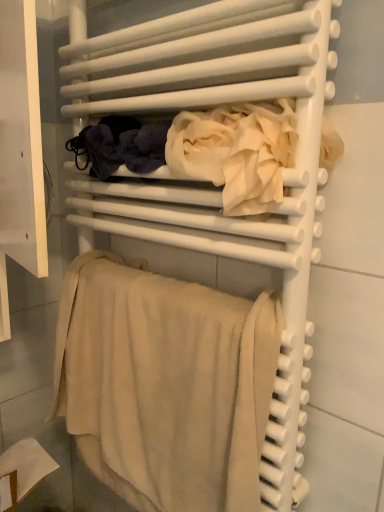
Image resolution: width=384 pixels, height=512 pixels. Describe the element at coordinates (165, 384) in the screenshot. I see `beige textured towel at lower center` at that location.

This screenshot has width=384, height=512. I want to click on beige textured towel at lower center, so click(x=165, y=384).

Describe the element at coordinates (204, 150) in the screenshot. I see `white cotton towel at center` at that location.

This screenshot has width=384, height=512. I want to click on white cotton towel at center, so click(x=204, y=150).

Image resolution: width=384 pixels, height=512 pixels. In order to click on beige textured towel at lower center in this screenshot , I will do `click(165, 384)`.

Considering the positions of objects white cotton towel at center and beige textured towel at lower center in the image provided, who is more to the left, white cotton towel at center or beige textured towel at lower center?

From the viewer's perspective, beige textured towel at lower center appears more on the left side.

Is the position of white cotton towel at center less distant than that of beige textured towel at lower center?

Yes, it is.

Does point (182, 136) come farther from viewer compared to point (229, 472)?

No, it is not.

From the image's perspective, is white cotton towel at center located above or below beige textured towel at lower center?

Based on their image positions, white cotton towel at center is located above beige textured towel at lower center.

From a real-world perspective, is white cotton towel at center positioned over beige textured towel at lower center based on gravity?

Yes, from a real-world perspective, white cotton towel at center is on top of beige textured towel at lower center.

Between white cotton towel at center and beige textured towel at lower center, which one has larger width?

With larger width is white cotton towel at center.

Is white cotton towel at center taller or shorter than beige textured towel at lower center?

white cotton towel at center is shorter than beige textured towel at lower center.

Based on their sizes in the image, would you say white cotton towel at center is bigger or smaller than beige textured towel at lower center?

Considering their sizes, white cotton towel at center takes up less space than beige textured towel at lower center.

Is white cotton towel at center completely or partially outside of beige textured towel at lower center?

Absolutely, white cotton towel at center is external to beige textured towel at lower center.

Can you see white cotton towel at center touching beige textured towel at lower center?

They are not placed beside each other.

Is beige textured towel at lower center at the back of white cotton towel at center?

No.

At what (x,y) coordinates should I click in order to perform the action: click on towel located underneath the white cotton towel at center (from a real-world perspective). Please return your answer as a coordinate pair (x, y). This screenshot has height=512, width=384. Looking at the image, I should click on (165, 384).

From the picture: Considering the positions of objects beige textured towel at lower center and white cotton towel at center in the image provided, who is more to the left, beige textured towel at lower center or white cotton towel at center?

beige textured towel at lower center is more to the left.

Which is behind, beige textured towel at lower center or white cotton towel at center?

beige textured towel at lower center is behind.

Between point (135, 386) and point (249, 113), which one is positioned behind?

Point (135, 386)

In the scene shown: From the image's perspective, does beige textured towel at lower center appear lower than white cotton towel at center?

Correct, beige textured towel at lower center appears lower than white cotton towel at center in the image.

From a real-world perspective, is beige textured towel at lower center beneath white cotton towel at center?

Correct, in the physical world, beige textured towel at lower center is lower than white cotton towel at center.

Between beige textured towel at lower center and white cotton towel at center, which one has smaller width?

beige textured towel at lower center is thinner.

In terms of height, does beige textured towel at lower center look taller or shorter compared to white cotton towel at center?

beige textured towel at lower center is taller than white cotton towel at center.

Is beige textured towel at lower center bigger or smaller than white cotton towel at center?

beige textured towel at lower center is bigger than white cotton towel at center.

Would you say beige textured towel at lower center is outside white cotton towel at center?

Yes, beige textured towel at lower center is outside of white cotton towel at center.

Is there a large distance between beige textured towel at lower center and white cotton towel at center?

That's not correct — beige textured towel at lower center is a little close to white cotton towel at center.

Is beige textured towel at lower center positioned with its back to white cotton towel at center?

No.

How many degrees apart are the facing directions of beige textured towel at lower center and white cotton towel at center?

The angular difference between beige textured towel at lower center and white cotton towel at center is 3.52 degrees.

Locate an element on the screen. clothing in front of the beige textured towel at lower center is located at coordinates tap(204, 150).

Locate an element on the screen. towel lying on the left of white cotton towel at center is located at coordinates (165, 384).

The image size is (384, 512). Identify the location of towel lying behind the white cotton towel at center. (165, 384).